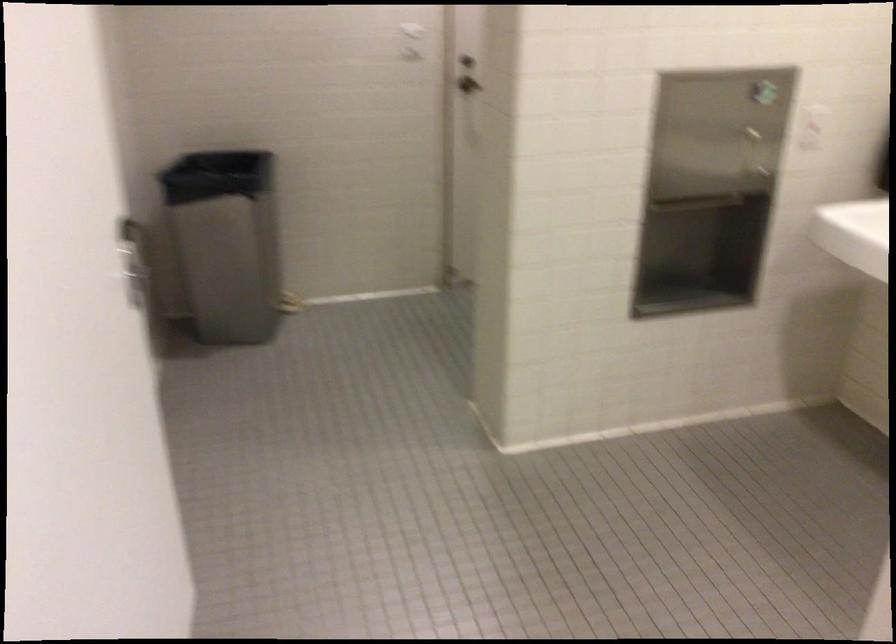
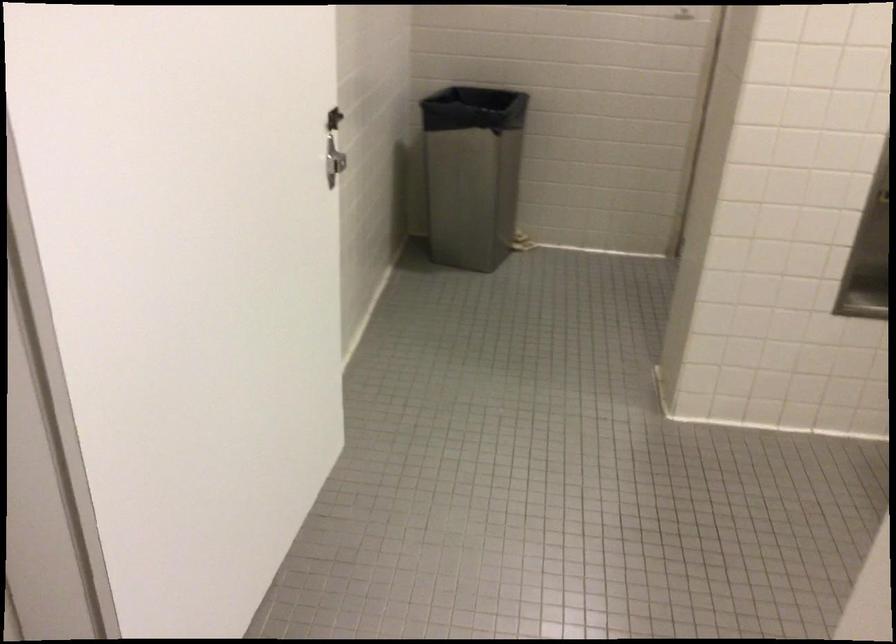
In the second image, find the point that corresponds to the point at 236,245 in the first image.

(471, 173)